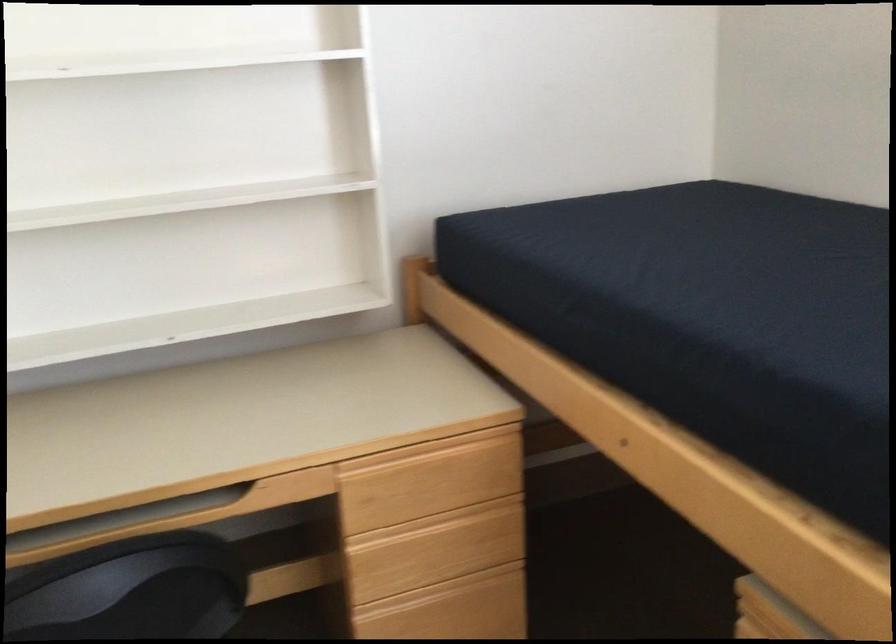
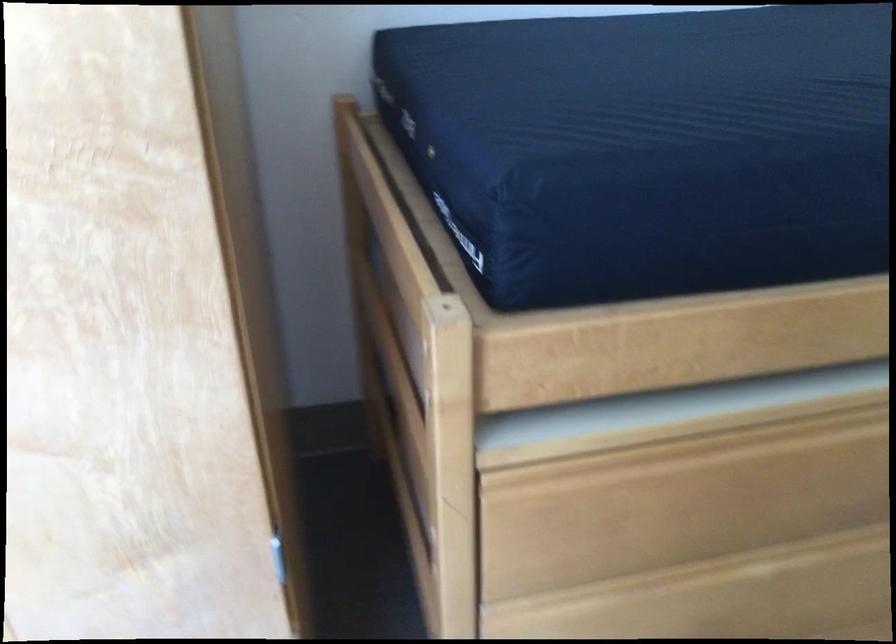
How did the camera likely rotate?

The camera rotated toward left-down.